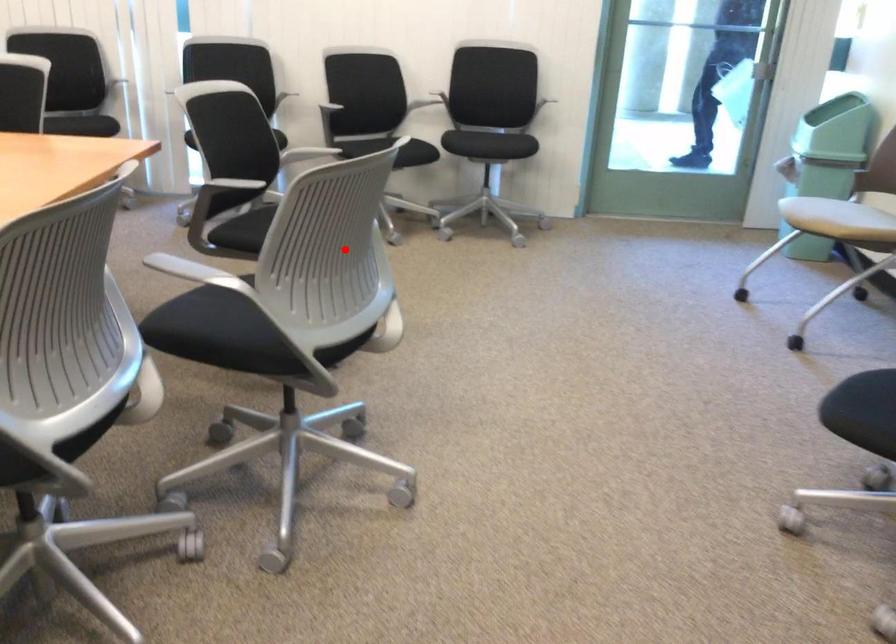
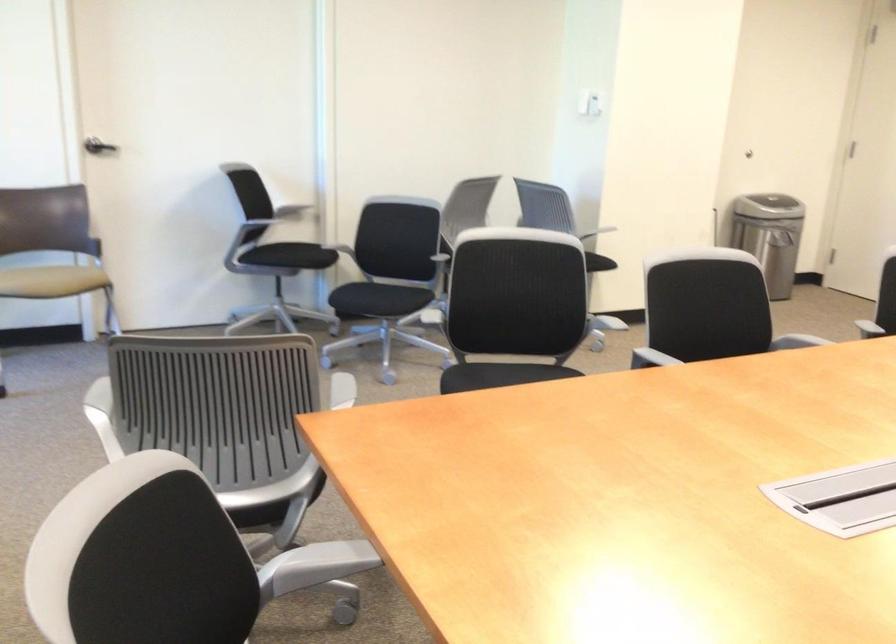
Locate, in the second image, the point that corresponds to the highlighted location in the first image.

(513, 307)